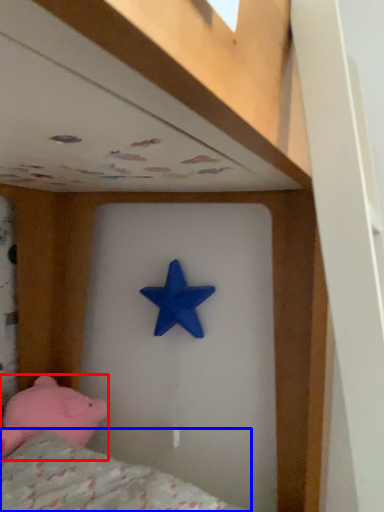
Question: Which point is further to the camera, toy (highlighted by a red box) or mattress (highlighted by a blue box)?

Choices:
 (A) toy
 (B) mattress

Answer: (A)